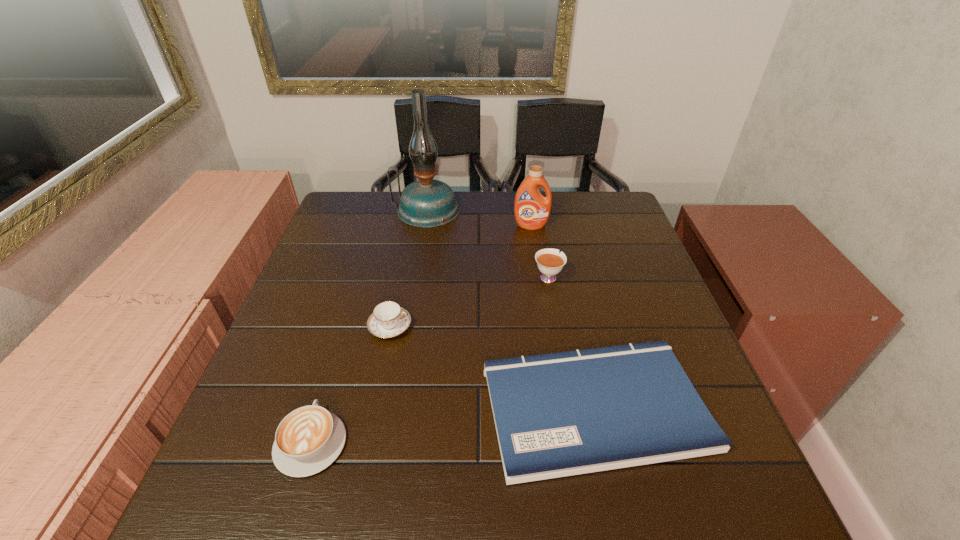
What are the coordinates of `cappuccino located at the near edge` in the screenshot? It's located at coord(309,439).

What are the coordinates of `paperback book that is at the near edge` in the screenshot? It's located at [561, 414].

Find the location of a particular element. object that is at the left edge is located at coordinates (309, 439).

Find the location of a particular element. The height and width of the screenshot is (540, 960). object located at the right edge is located at coordinates tap(561, 414).

At what (x,y) coordinates should I click in order to perform the action: click on object that is at the near left corner. Please return your answer as a coordinate pair (x, y). The image size is (960, 540). Looking at the image, I should click on (309, 439).

At what (x,y) coordinates should I click in order to perform the action: click on object that is positioned at the near right corner. Please return your answer as a coordinate pair (x, y). The width and height of the screenshot is (960, 540). Looking at the image, I should click on (561, 414).

Where is `free space at the far edge of the desktop`? The image size is (960, 540). free space at the far edge of the desktop is located at coordinates point(559,206).

Identify the location of blank area at the near edge. (374, 489).

The image size is (960, 540). Find the location of `free space at the left edge`. free space at the left edge is located at coordinates (320, 238).

Identify the location of free space at the right edge. The height and width of the screenshot is (540, 960). (588, 245).